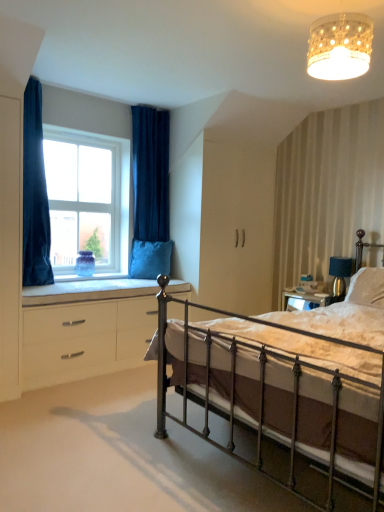
Question: Does white glass window at upper left have a greater height compared to velvet blue curtain at upper left, the first curtain when ordered from right to left?

Choices:
 (A) no
 (B) yes

Answer: (A)

Question: Is the position of white glass window at upper left less distant than that of velvet blue curtain at upper left, the first curtain when ordered from right to left?

Choices:
 (A) no
 (B) yes

Answer: (B)

Question: Is white glass window at upper left aimed at velvet blue curtain at upper left, the first curtain when ordered from right to left?

Choices:
 (A) no
 (B) yes

Answer: (A)

Question: Is white glass window at upper left not inside velvet blue curtain at upper left, which is the 2th curtain from left to right?

Choices:
 (A) yes
 (B) no

Answer: (A)

Question: Is white glass window at upper left positioned behind velvet blue curtain at upper left, placed as the 2th curtain when sorted from front to back?

Choices:
 (A) yes
 (B) no

Answer: (B)

Question: Is white textured lampshade at upper center wider or thinner than velvet blue pillow at window, the 2th pillow when ordered from front to back?

Choices:
 (A) thin
 (B) wide

Answer: (A)

Question: From a real-world perspective, is white textured lampshade at upper center above or below velvet blue pillow at window, placed as the first pillow when sorted from back to front?

Choices:
 (A) below
 (B) above

Answer: (B)

Question: Is point (364, 33) positioned closer to the camera than point (168, 270)?

Choices:
 (A) farther
 (B) closer

Answer: (B)

Question: In terms of height, does white textured lampshade at upper center look taller or shorter compared to velvet blue pillow at window, the first pillow in the left-to-right sequence?

Choices:
 (A) short
 (B) tall

Answer: (A)

Question: Looking at the image, does white glossy chest of drawers at lower left seem bigger or smaller compared to polished metal bed at center?

Choices:
 (A) small
 (B) big

Answer: (A)

Question: Considering the positions of white glossy chest of drawers at lower left and polished metal bed at center in the image, is white glossy chest of drawers at lower left taller or shorter than polished metal bed at center?

Choices:
 (A) short
 (B) tall

Answer: (A)

Question: In the image, is white glossy chest of drawers at lower left positioned in front of or behind polished metal bed at center?

Choices:
 (A) front
 (B) behind

Answer: (B)

Question: Considering the positions of white glossy chest of drawers at lower left and polished metal bed at center in the image, is white glossy chest of drawers at lower left wider or thinner than polished metal bed at center?

Choices:
 (A) wide
 (B) thin

Answer: (B)

Question: In the image, is velvet blue curtain at upper left, acting as the 1th curtain starting from the back, positioned in front of or behind velvet blue pillow at window, the 2th pillow when ordered from front to back?

Choices:
 (A) behind
 (B) front

Answer: (B)

Question: Does point (160, 141) appear closer or farther from the camera than point (152, 269)?

Choices:
 (A) closer
 (B) farther

Answer: (B)